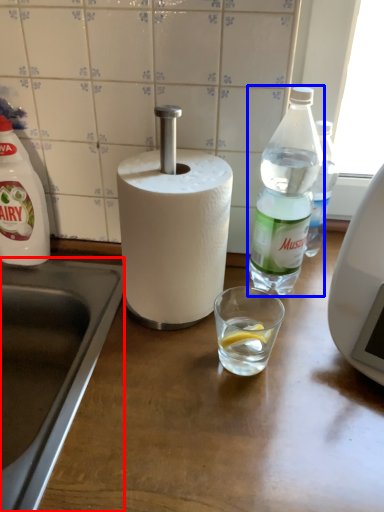
Question: Among these objects, which one is farthest to the camera, sink (highlighted by a red box) or bottle (highlighted by a blue box)?

Choices:
 (A) sink
 (B) bottle

Answer: (B)